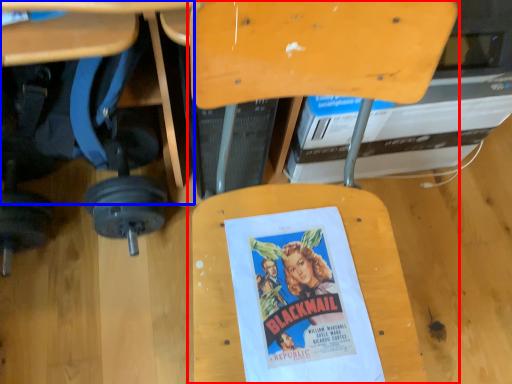
Question: Which point is closer to the camera, chair (highlighted by a red box) or table (highlighted by a blue box)?

Choices:
 (A) chair
 (B) table

Answer: (A)